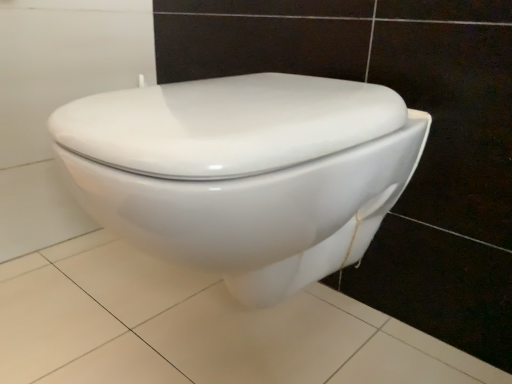
Measure the distance between white glossy toilet at center and camera.

white glossy toilet at center is 14.59 inches from camera.

Describe the element at coordinates (243, 172) in the screenshot. I see `white glossy toilet at center` at that location.

This screenshot has width=512, height=384. Find the location of `white glossy toilet at center`. white glossy toilet at center is located at coordinates (243, 172).

Image resolution: width=512 pixels, height=384 pixels. In order to click on white glossy toilet at center in this screenshot , I will do `click(243, 172)`.